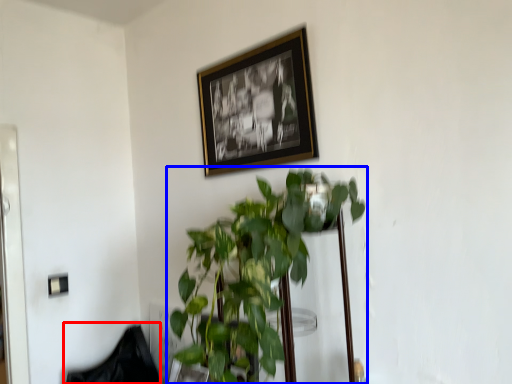
Question: Which object is closer to the camera taking this photo, swivel chair (highlighted by a red box) or houseplant (highlighted by a blue box)?

Choices:
 (A) swivel chair
 (B) houseplant

Answer: (B)